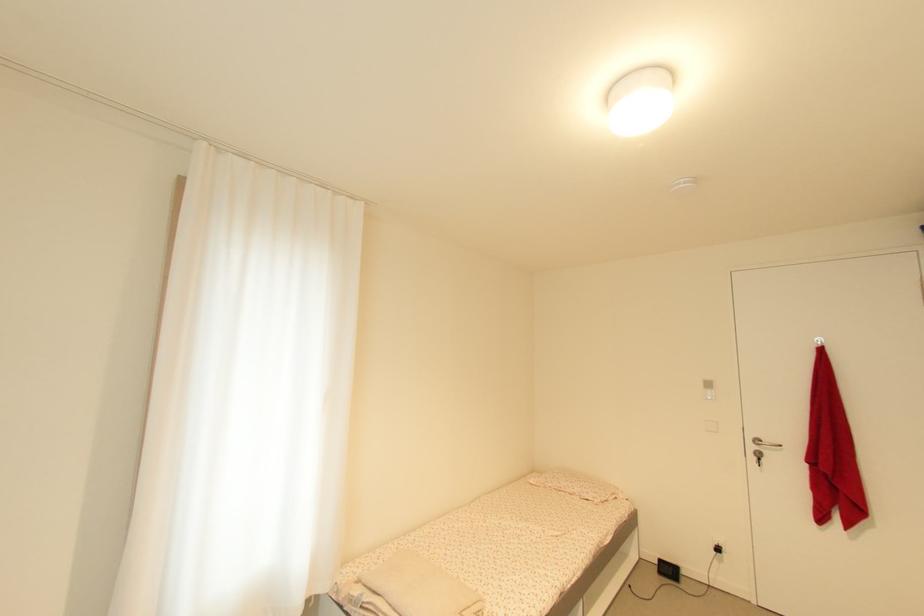
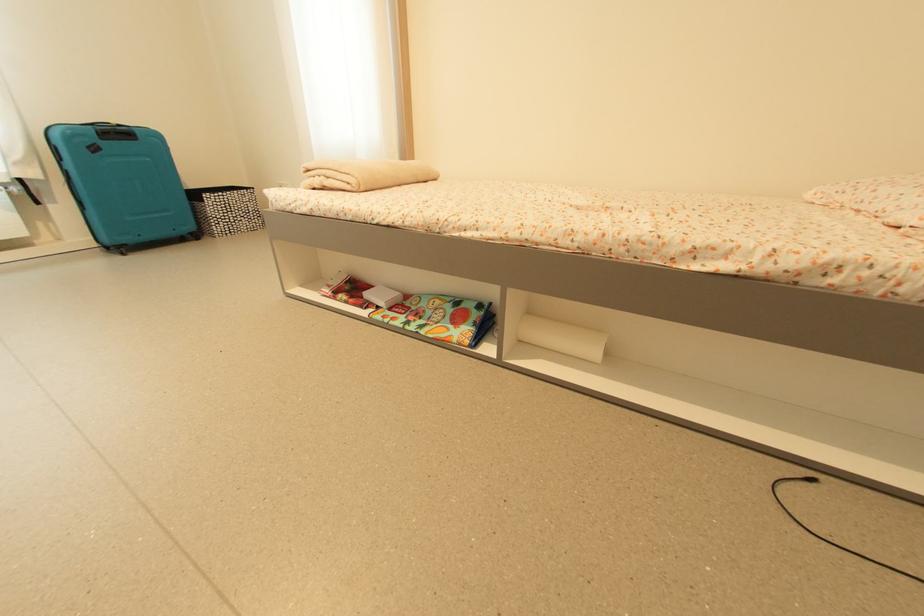
Where in the second image is the point corresponding to (635,588) from the first image?

(817, 483)